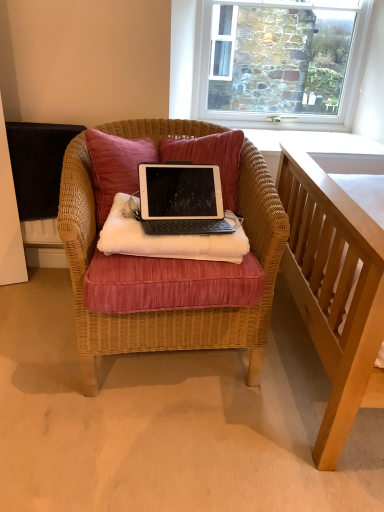
This screenshot has height=512, width=384. What are the coordinates of `free space above black matte tablet at center (from a real-world perspective)` in the screenshot? It's located at (180, 215).